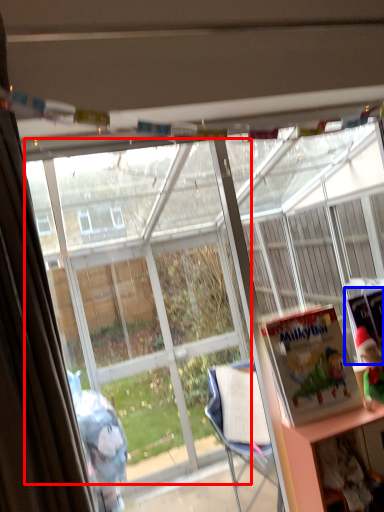
Question: Which object is further to the camera taking this photo, bay window (highlighted by a red box) or book (highlighted by a blue box)?

Choices:
 (A) bay window
 (B) book

Answer: (B)